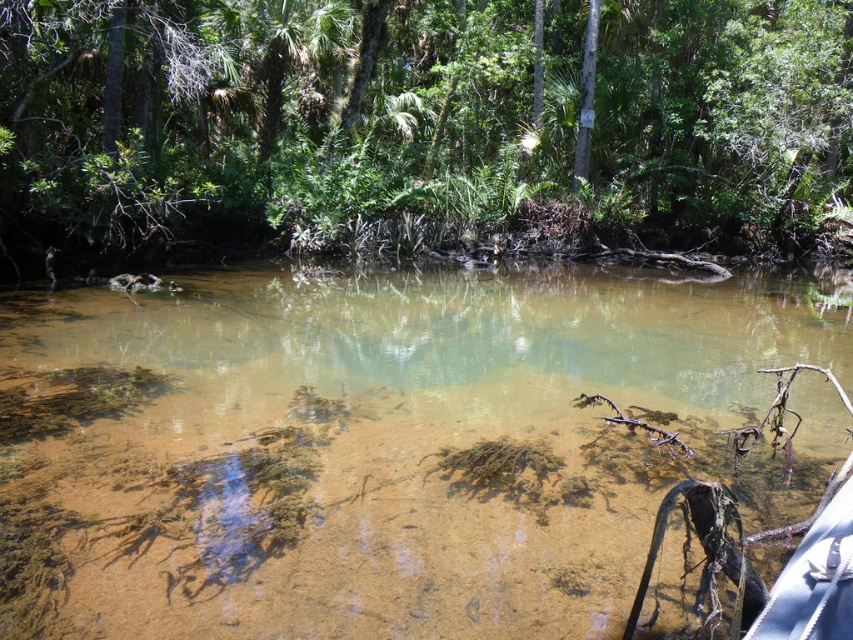
Question: Which object is closer to the camera taking this photo?

Choices:
 (A) clear sediment river at center
 (B) green leafy tree at upper center

Answer: (A)

Question: Is clear sediment river at center above green leafy tree at upper center?

Choices:
 (A) yes
 (B) no

Answer: (B)

Question: Is clear sediment river at center closer to the viewer compared to green leafy tree at upper center?

Choices:
 (A) yes
 (B) no

Answer: (A)

Question: Which point is closer to the camera taking this photo?

Choices:
 (A) (457, 189)
 (B) (260, 380)

Answer: (B)

Question: Which of the following is the farthest from the observer?

Choices:
 (A) clear sediment river at center
 (B) green leafy tree at upper center

Answer: (B)

Question: Where is clear sediment river at center located in relation to green leafy tree at upper center in the image?

Choices:
 (A) above
 (B) below

Answer: (B)